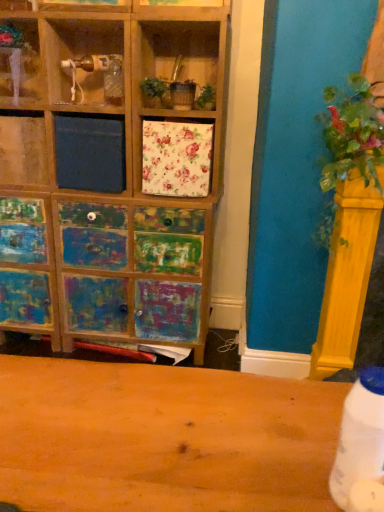
Question: Considering the relative positions of wooden shelf at upper left and green leafy plant at right in the image provided, is wooden shelf at upper left in front of green leafy plant at right?

Choices:
 (A) no
 (B) yes

Answer: (A)

Question: Does wooden shelf at upper left have a lesser width compared to green leafy plant at right?

Choices:
 (A) yes
 (B) no

Answer: (A)

Question: Is the surface of wooden shelf at upper left in direct contact with green leafy plant at right?

Choices:
 (A) yes
 (B) no

Answer: (B)

Question: From a real-world perspective, is wooden shelf at upper left located beneath green leafy plant at right?

Choices:
 (A) no
 (B) yes

Answer: (A)

Question: Can you confirm if wooden shelf at upper left is positioned to the right of green leafy plant at right?

Choices:
 (A) yes
 (B) no

Answer: (B)

Question: Considering the positions of white plastic bottle at lower right and wooden shelf at upper left in the image, is white plastic bottle at lower right taller or shorter than wooden shelf at upper left?

Choices:
 (A) tall
 (B) short

Answer: (B)

Question: In the image, is white plastic bottle at lower right positioned in front of or behind wooden shelf at upper left?

Choices:
 (A) behind
 (B) front

Answer: (B)

Question: Considering the positions of white plastic bottle at lower right and wooden shelf at upper left in the image, is white plastic bottle at lower right wider or thinner than wooden shelf at upper left?

Choices:
 (A) thin
 (B) wide

Answer: (A)

Question: Is white plastic bottle at lower right to the left or to the right of wooden shelf at upper left in the image?

Choices:
 (A) left
 (B) right

Answer: (B)

Question: From a real-world perspective, is wooden shelf at upper left above or below green leafy plant at right?

Choices:
 (A) below
 (B) above

Answer: (B)

Question: Considering the relative positions of wooden shelf at upper left and green leafy plant at right in the image provided, is wooden shelf at upper left to the left or to the right of green leafy plant at right?

Choices:
 (A) right
 (B) left

Answer: (B)

Question: Looking at the image, does wooden shelf at upper left seem bigger or smaller compared to green leafy plant at right?

Choices:
 (A) small
 (B) big

Answer: (A)

Question: In terms of width, does wooden shelf at upper left look wider or thinner when compared to green leafy plant at right?

Choices:
 (A) wide
 (B) thin

Answer: (B)

Question: Is point (340, 489) closer or farther from the camera than point (329, 145)?

Choices:
 (A) closer
 (B) farther

Answer: (A)

Question: Looking at their shapes, would you say white plastic bottle at lower right is wider or thinner than green leafy plant at right?

Choices:
 (A) wide
 (B) thin

Answer: (B)